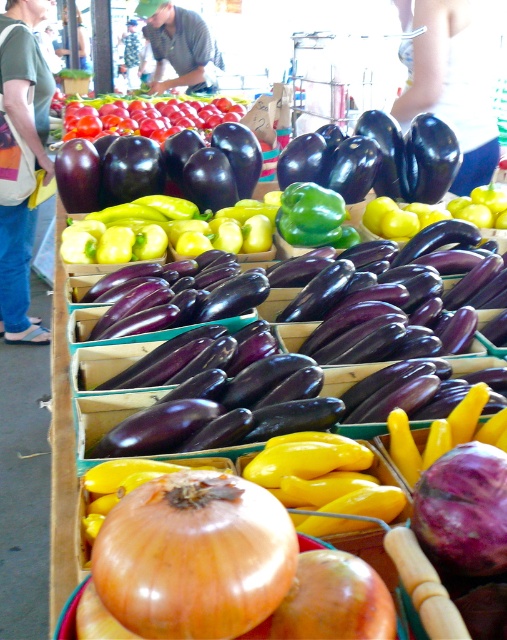
Who is more forward, (254, 600) or (2, 321)?

Point (254, 600) is more forward.

This screenshot has height=640, width=507. In order to click on smooth orange onion at center in this screenshot , I will do click(x=194, y=556).

Based on the photo, is smooth orange onion at center below gray cotton shirt at center?

Yes, smooth orange onion at center is below gray cotton shirt at center.

Can you confirm if smooth orange onion at center is positioned above gray cotton shirt at center?

No.

Identify the location of smooth orange onion at center. (194, 556).

Is point (455, 560) positioned before point (202, 90)?

Yes.

Does smooth purple onion at center appear on the left side of gray cotton shirt at center?

Incorrect, smooth purple onion at center is not on the left side of gray cotton shirt at center.

Locate an element on the screen. smooth purple onion at center is located at coordinates (463, 509).